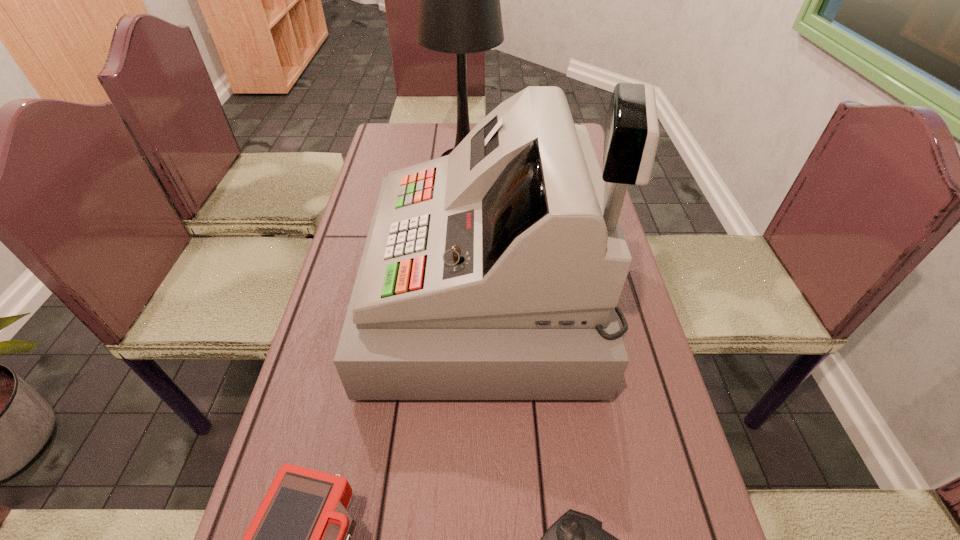
Identify the location of table lamp. This screenshot has height=540, width=960. (459, 0).

Find the location of a particular element. the third nearest object is located at coordinates (493, 273).

The height and width of the screenshot is (540, 960). I want to click on vacant space located on the front of the farthest object, so click(461, 234).

I want to click on vacant space located on the keypad side of the cash register, so click(x=346, y=296).

At what (x,y) coordinates should I click in order to perform the action: click on blank space located 0.090m on the keypad side of the cash register. Please return your answer as a coordinate pair (x, y). The image size is (960, 540). Looking at the image, I should click on (337, 296).

You are a GUI agent. You are given a task and a screenshot of the screen. Output one action in this format:
    pyautogui.click(x=<x>, y=<y>)
    Task: Click on the object present at the far edge
    The width and height of the screenshot is (960, 540).
    Given the screenshot: What is the action you would take?
    pyautogui.click(x=459, y=0)

You are a GUI agent. You are given a task and a screenshot of the screen. Output one action in this format:
    pyautogui.click(x=<x>, y=<y>)
    Task: Click on the object that is at the left edge
    This screenshot has width=960, height=540.
    Given the screenshot: What is the action you would take?
    pyautogui.click(x=493, y=273)

The width and height of the screenshot is (960, 540). I want to click on object that is at the right edge, so click(x=493, y=273).

Find the location of a particular element. Image resolution: width=960 pixels, height=540 pixels. vacant space at the far edge of the desktop is located at coordinates (440, 125).

Image resolution: width=960 pixels, height=540 pixels. Identify the location of vacant point at the left edge. (359, 215).